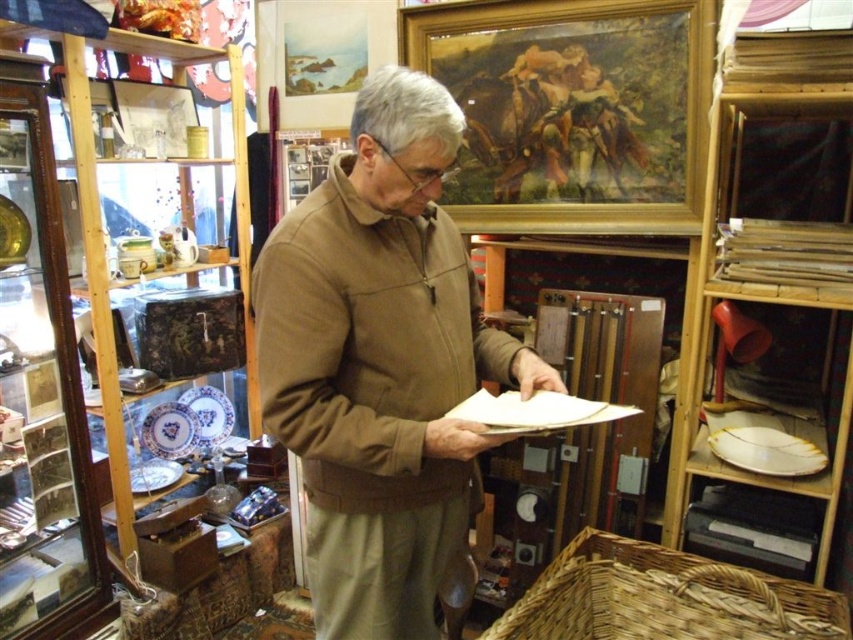
Consider the image. You are a customer in the antique shop and want to see the blue porcelain plate at center clearly. However, the brown soft jacket at center is blocking your view. How can you adjust your position to see the plate better?

The brown soft jacket at center is in front of the blue porcelain plate at center. To see the plate better, you should move around the jacket to a position where the plate is no longer blocked by the jacket.

You are a customer in the antique shop and want to place the brown soft jacket at center on top of the porcelain plate at center. Is this possible based on their current positions?

The brown soft jacket at center is currently above the porcelain plate at center, so placing it on top would require moving it downward, which is feasible as they are vertically aligned.